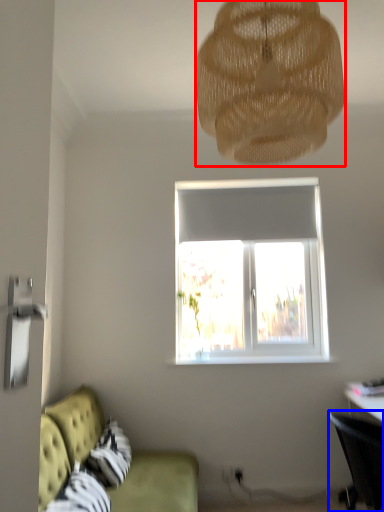
Question: Which object is further to the camera taking this photo, lamp (highlighted by a red box) or chair (highlighted by a blue box)?

Choices:
 (A) lamp
 (B) chair

Answer: (B)